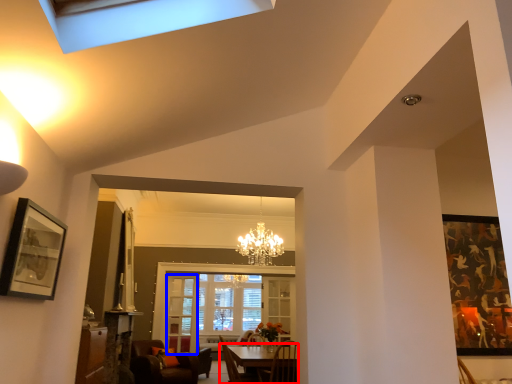
Question: Which point is closer to the camera, table (highlighted by a red box) or glass door (highlighted by a blue box)?

Choices:
 (A) table
 (B) glass door

Answer: (A)